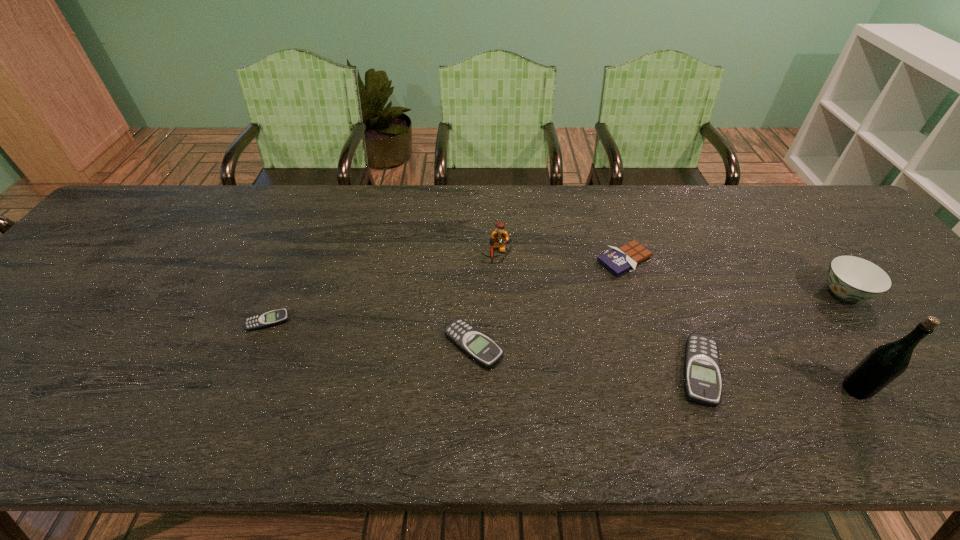
Please point out where to position a new beeper on the right to maintain spacing. Please provide its 2D coordinates. Your answer should be formatted as a tuple, i.e. [(x, y)], where the tuple contains the x and y coordinates of a point satisfying the conditions above.

[(949, 401)]